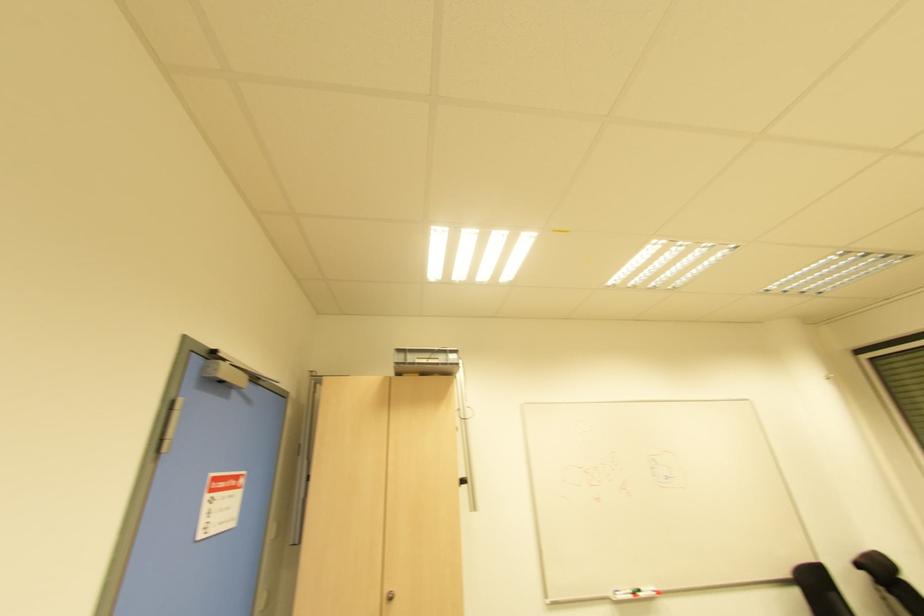
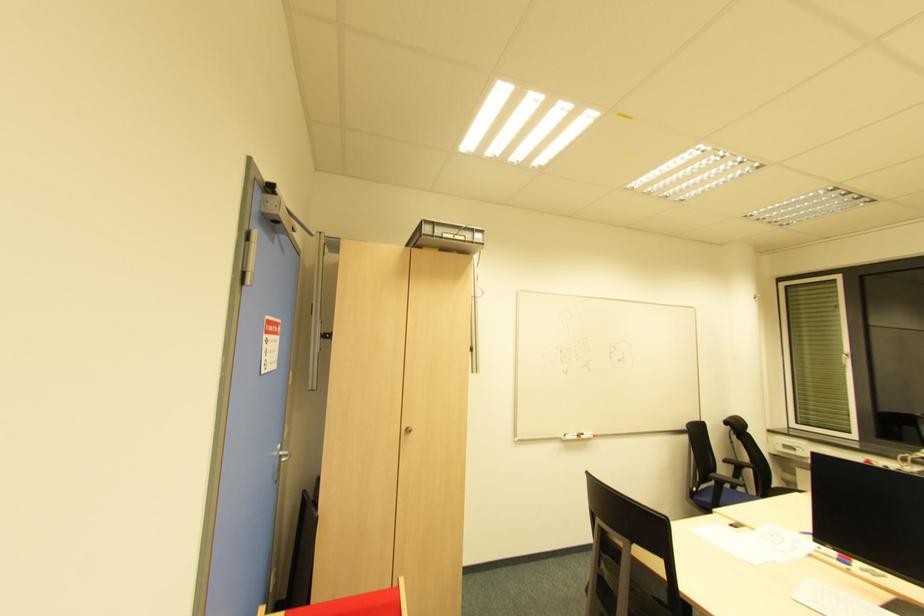
Question: How did the camera likely rotate?

Choices:
 (A) Left
 (B) Right
 (C) Up
 (D) Down

Answer: (D)